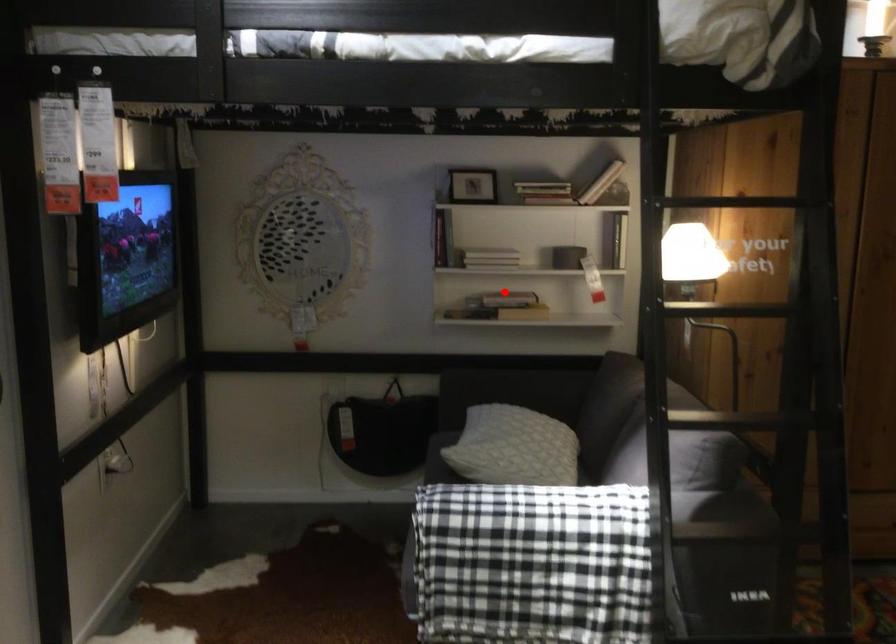
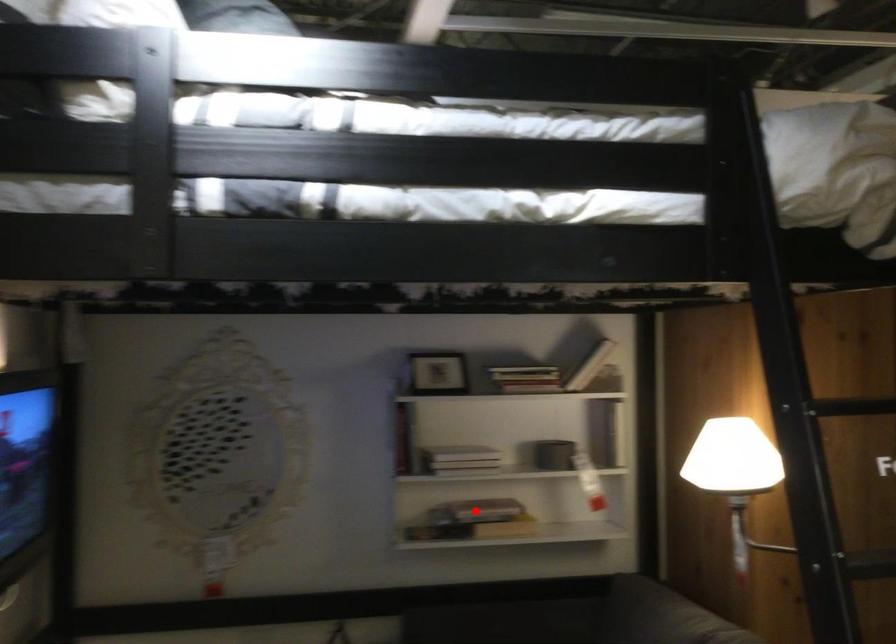
Based on the photo, I am providing you with two images of the same scene from different viewpoints. A red point is marked on the first image and another point is marked on the second image. Is the marked point in image1 the same physical position as the marked point in image2?

Yes